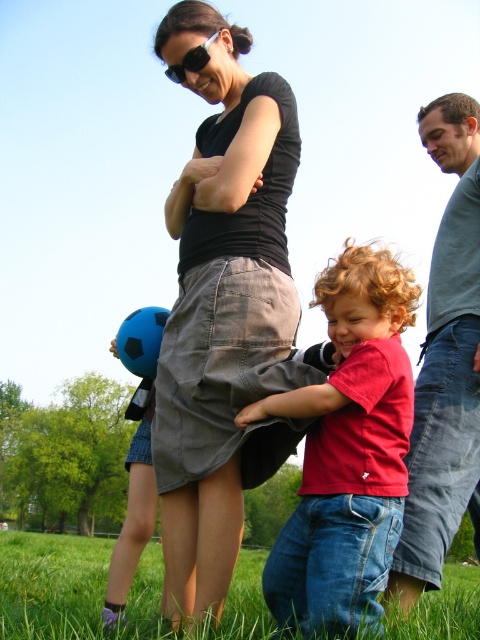
You are a photographer trying to capture a candid shot of the scene. You notice the matte black shirt at center and the black plastic sunglasses at upper center. Which object is located to the right of the other?

The matte black shirt at center is positioned on the right side of black plastic sunglasses at upper center.

You are a photographer trying to capture the scene. Since the matte red shirt at center and the black plastic sunglasses at upper center are both important elements, which object should you focus on if you want to highlight the smaller one?

The matte red shirt at center should be focused on because it occupies less space than the black plastic sunglasses at upper center, making it the smaller object to highlight.